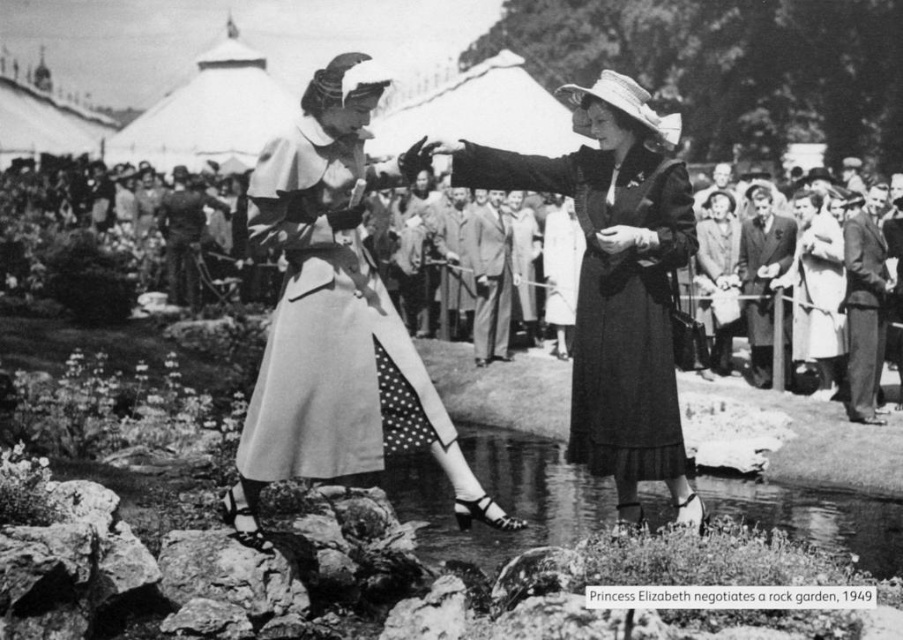
Question: Is light beige fabric dress at center bigger than smooth fabric suits at center?

Choices:
 (A) yes
 (B) no

Answer: (B)

Question: Which point is farther to the camera?

Choices:
 (A) (676, 262)
 (B) (839, 326)
 (C) (816, 488)

Answer: (B)

Question: Which of these objects is positioned farthest from the smooth fabric suits at center?

Choices:
 (A) light beige fabric dress at center
 (B) matte black dress at center
 (C) clear water at pond center
 (D) light beige fabric dress at right

Answer: (A)

Question: From the image, what is the correct spatial relationship of clear water at pond center in relation to light beige fabric dress at right?

Choices:
 (A) above
 (B) below

Answer: (B)

Question: Does matte black dress at center appear on the left side of light beige fabric dress at center?

Choices:
 (A) yes
 (B) no

Answer: (B)

Question: Which of the following is the farthest from the observer?

Choices:
 (A) (784, 500)
 (B) (361, 252)

Answer: (A)